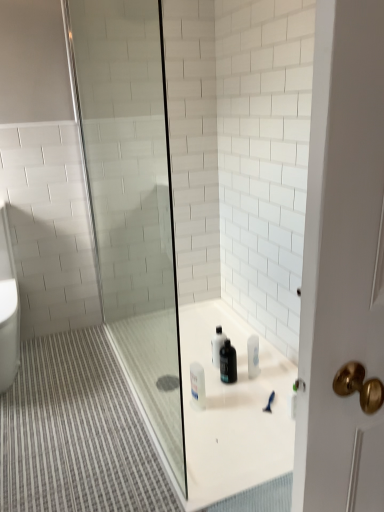
Question: Are transparent glass shower door at center and black matte bottle at center beside each other?

Choices:
 (A) yes
 (B) no

Answer: (B)

Question: Is transparent glass shower door at center behind black matte bottle at center?

Choices:
 (A) no
 (B) yes

Answer: (A)

Question: Is transparent glass shower door at center positioned with its back to black matte bottle at center?

Choices:
 (A) no
 (B) yes

Answer: (A)

Question: From the image's perspective, is transparent glass shower door at center located beneath black matte bottle at center?

Choices:
 (A) yes
 (B) no

Answer: (B)

Question: Does transparent glass shower door at center appear on the right side of black matte bottle at center?

Choices:
 (A) yes
 (B) no

Answer: (B)

Question: Is transparent glass shower door at center far from black matte bottle at center?

Choices:
 (A) no
 (B) yes

Answer: (B)

Question: From a real-world perspective, does black matte bottle at center sit lower than transparent glass shower door at center?

Choices:
 (A) yes
 (B) no

Answer: (A)

Question: Is black matte bottle at center to the right of transparent glass shower door at center from the viewer's perspective?

Choices:
 (A) no
 (B) yes

Answer: (B)

Question: Is black matte bottle at center not inside transparent glass shower door at center?

Choices:
 (A) yes
 (B) no

Answer: (A)

Question: Is the surface of black matte bottle at center in direct contact with transparent glass shower door at center?

Choices:
 (A) no
 (B) yes

Answer: (A)

Question: Is black matte bottle at center wider than transparent glass shower door at center?

Choices:
 (A) yes
 (B) no

Answer: (B)

Question: Is black matte bottle at center thinner than transparent glass shower door at center?

Choices:
 (A) no
 (B) yes

Answer: (B)

Question: Considering the positions of black matte bottle at center and transparent glass shower door at center in the image, is black matte bottle at center taller or shorter than transparent glass shower door at center?

Choices:
 (A) tall
 (B) short

Answer: (B)